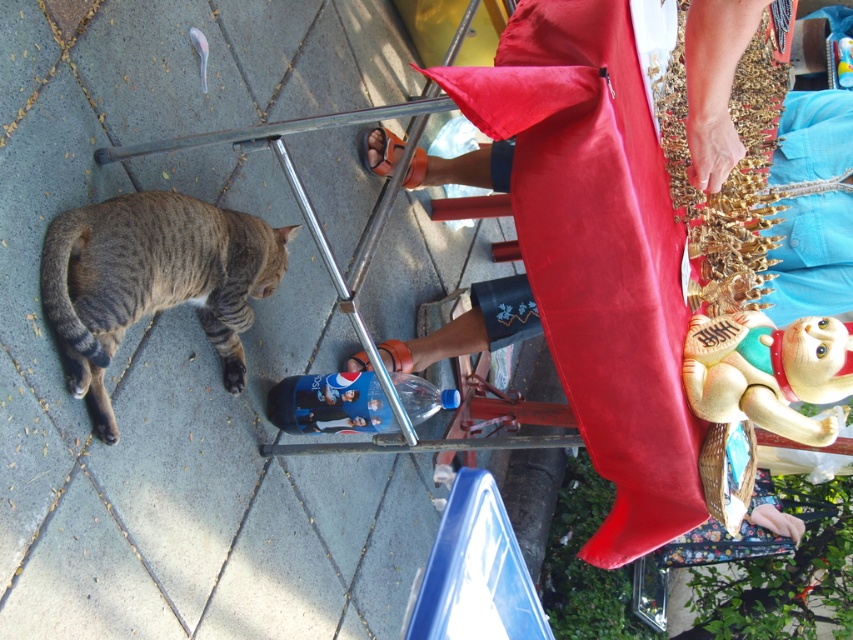
Is gray tabby cat at lower left in front of beige rubber cat at lower right?

Yes, gray tabby cat at lower left is closer to the viewer.

Which is below, gray tabby cat at lower left or beige rubber cat at lower right?

beige rubber cat at lower right is lower down.

Does point (136, 237) come behind point (721, 392)?

No, it is in front of (721, 392).

Locate an element on the screen. This screenshot has height=640, width=853. gray tabby cat at lower left is located at coordinates (152, 280).

Can you confirm if gray concrete pavement at lower left is positioned above gray tabby cat at lower left?

No, gray concrete pavement at lower left is not above gray tabby cat at lower left.

Who is lower down, gray concrete pavement at lower left or gray tabby cat at lower left?

gray concrete pavement at lower left

Which is in front, point (112, 67) or point (146, 227)?

Point (146, 227) is in front.

You are a GUI agent. You are given a task and a screenshot of the screen. Output one action in this format:
    pyautogui.click(x=<x>, y=<y>)
    Task: Click on the gray concrete pavement at lower left
    
    Given the screenshot: What is the action you would take?
    pyautogui.click(x=189, y=342)

Does gray concrete pavement at lower left have a lesser height compared to beige rubber cat at lower right?

No, gray concrete pavement at lower left is not shorter than beige rubber cat at lower right.

Who is positioned more to the left, gray concrete pavement at lower left or beige rubber cat at lower right?

Positioned to the left is gray concrete pavement at lower left.

Who is more distant from viewer, (45, 72) or (817, 387)?

Point (45, 72)

You are a GUI agent. You are given a task and a screenshot of the screen. Output one action in this format:
    pyautogui.click(x=<x>, y=<y>)
    Task: Click on the gray concrete pavement at lower left
    The image size is (853, 640).
    Given the screenshot: What is the action you would take?
    pyautogui.click(x=189, y=342)